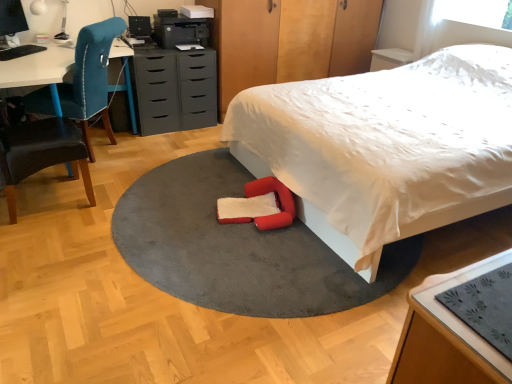
At what (x,y) coordinates should I click in order to perform the action: click on free spot in front of black plastic drawer at center. Please return your answer as a coordinate pair (x, y). Looking at the image, I should click on coord(155,142).